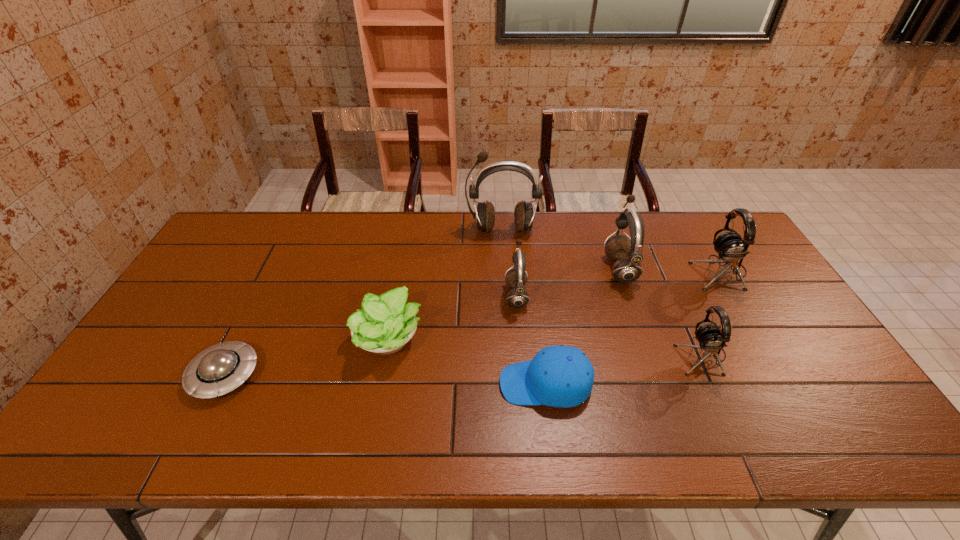
Find the location of a particular element. The height and width of the screenshot is (540, 960). the second object from left to right is located at coordinates (385, 324).

Locate an element on the screen. The image size is (960, 540). green lettuce is located at coordinates coord(385,324).

Identify the location of the leftmost object. (221, 368).

Find the location of `saucer`. saucer is located at coordinates (221, 368).

Where is `free space located 0.200m on the ear pads of the farthest earphone`? This screenshot has width=960, height=540. free space located 0.200m on the ear pads of the farthest earphone is located at coordinates (505, 279).

In order to click on vacant position located 0.270m on the left of the bigger black earphone in this screenshot , I will do `click(608, 272)`.

I want to click on free space located 0.090m on the ear pads of the rightmost brown earphone, so click(x=577, y=268).

What are the coordinates of `vacant space located on the ear pads of the rightmost brown earphone` in the screenshot? It's located at (524, 268).

At what (x,y) coordinates should I click in order to perform the action: click on free space located on the ear pads of the rightmost brown earphone. Please return your answer as a coordinate pair (x, y). Looking at the image, I should click on (517, 268).

At what (x,y) coordinates should I click in order to perform the action: click on vacant space situated 0.170m on the ear pads of the smallest brown earphone. Please return your answer as a coordinate pair (x, y). The image size is (960, 540). Looking at the image, I should click on (448, 295).